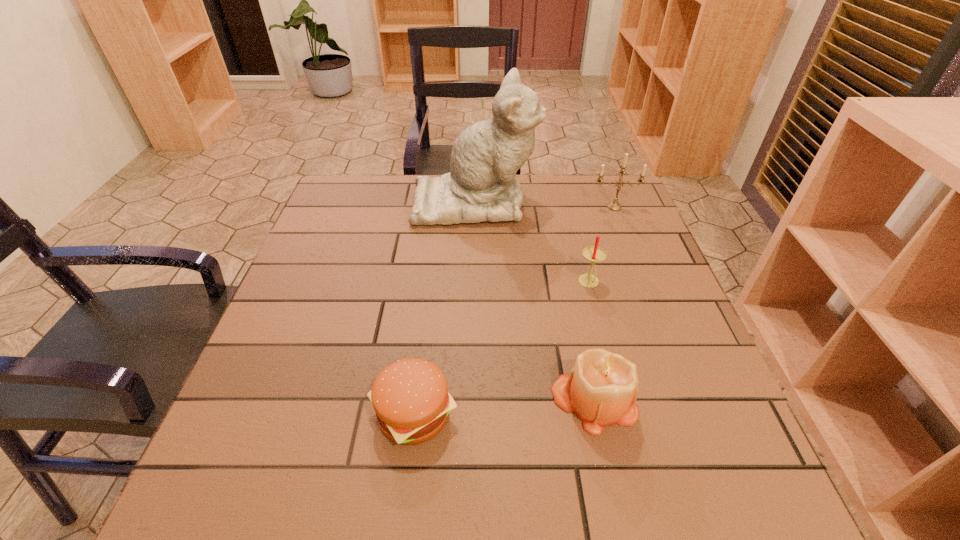
Locate an element on the screen. This screenshot has width=960, height=540. blank space located on the right of the shortest object is located at coordinates (564, 414).

The width and height of the screenshot is (960, 540). Identify the location of cat that is at the far edge. (481, 186).

Where is `candle that is at the far edge`? Image resolution: width=960 pixels, height=540 pixels. candle that is at the far edge is located at coordinates (614, 206).

This screenshot has width=960, height=540. In order to click on object that is at the far right corner in this screenshot , I will do `click(614, 206)`.

Where is `blank space at the far edge of the desktop`? blank space at the far edge of the desktop is located at coordinates (407, 177).

Identify the location of vacant position at the left edge of the desktop. This screenshot has height=540, width=960. (273, 350).

This screenshot has width=960, height=540. Find the location of `free space at the right edge`. free space at the right edge is located at coordinates point(675,326).

In the image, there is a desktop. Identify the location of vacant region at the far right corner. (603, 191).

You are a GUI agent. You are given a task and a screenshot of the screen. Output one action in this format:
    pyautogui.click(x=<x>, y=<y>)
    Task: Click on the vacant area between the farthest candle and the tallest object
    This screenshot has width=960, height=540.
    Given the screenshot: What is the action you would take?
    pyautogui.click(x=544, y=204)

Where is `vacant point located between the shortest object and the nearest candle`? The image size is (960, 540). vacant point located between the shortest object and the nearest candle is located at coordinates (504, 407).